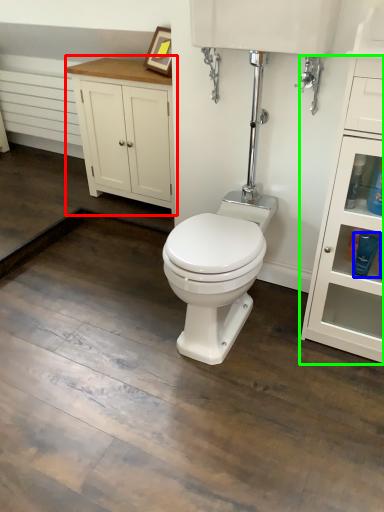
Question: Which is farther away from bathroom cabinet (highlighted by a red box)? toiletry (highlighted by a blue box) or dresser (highlighted by a green box)?

Choices:
 (A) toiletry
 (B) dresser

Answer: (A)